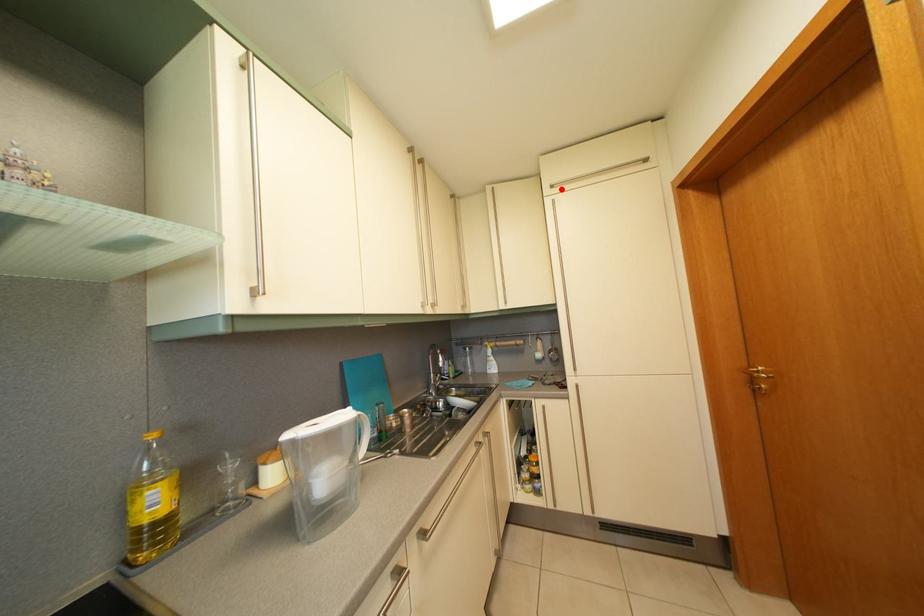
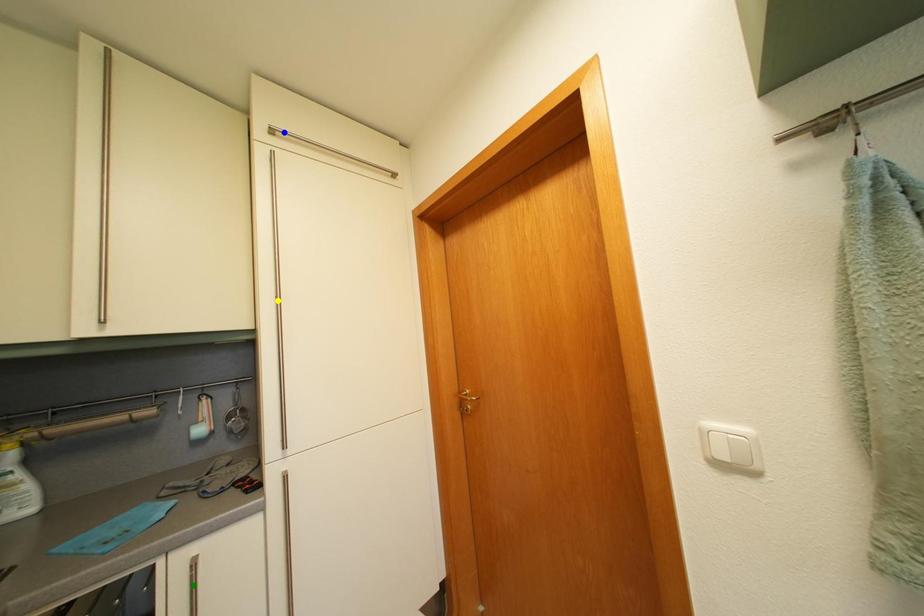
Question: I am providing you with two images of the same scene from different viewpoints. A red point is marked on the first image. You are given multiple points on the second image. Which spot in image 2 lines up with the point in image 1?

Choices:
 (A) blue point
 (B) green point
 (C) yellow point

Answer: (A)